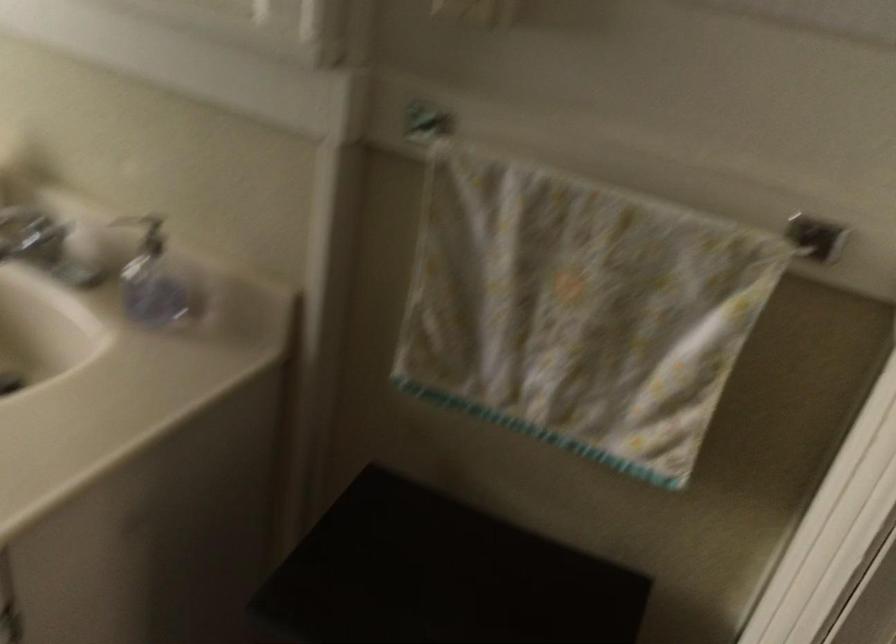
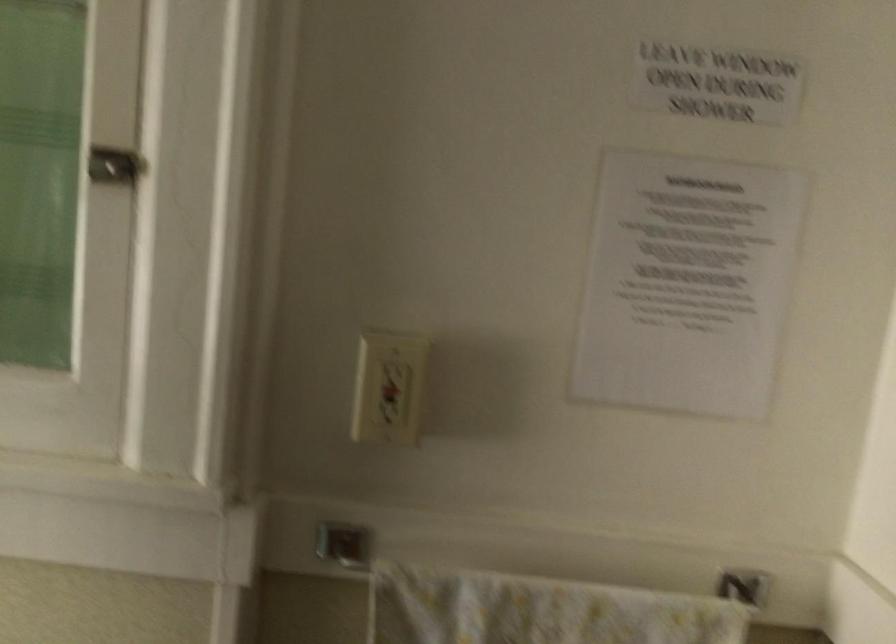
Question: Based on the continuous images, in which direction is the camera rotating? Reply with the corresponding letter.

Choices:
 (A) Left
 (B) Right
 (C) Up
 (D) Down

Answer: (B)